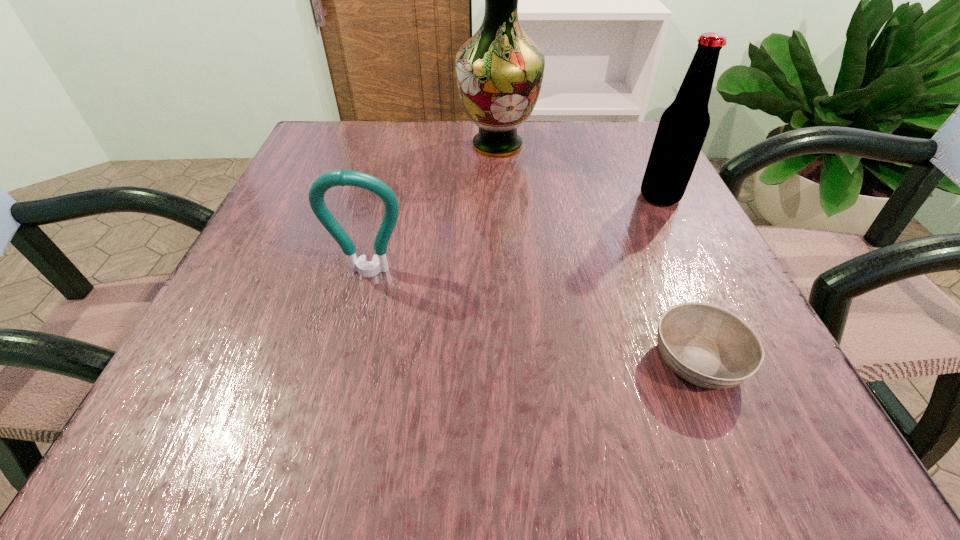
I want to click on vacant space at the left edge, so click(x=316, y=323).

Where is `vacant space at the near left corner of the desktop`? vacant space at the near left corner of the desktop is located at coordinates (175, 421).

Locate an element on the screen. The image size is (960, 540). free space at the far right corner of the desktop is located at coordinates (630, 123).

Locate an element on the screen. vacant space that's between the nearest object and the second farthest object is located at coordinates (679, 279).

The height and width of the screenshot is (540, 960). I want to click on empty space between the vase and the second tallest object, so click(579, 171).

You are a GUI agent. You are given a task and a screenshot of the screen. Output one action in this format:
    pyautogui.click(x=<x>, y=<y>)
    Task: Click on the free spot between the third nearest object and the leftmost object
    This screenshot has height=540, width=960.
    Given the screenshot: What is the action you would take?
    pyautogui.click(x=515, y=235)

Where is `empty location between the farthest object and the second farthest object`? empty location between the farthest object and the second farthest object is located at coordinates (579, 171).

Identify the location of vacant region between the shortest object and the vase. (597, 253).

Locate an element on the screen. The height and width of the screenshot is (540, 960). free space between the second farthest object and the farthest object is located at coordinates (579, 171).

This screenshot has height=540, width=960. In order to click on free spot between the vase and the leftmost object in this screenshot , I will do pos(433,209).